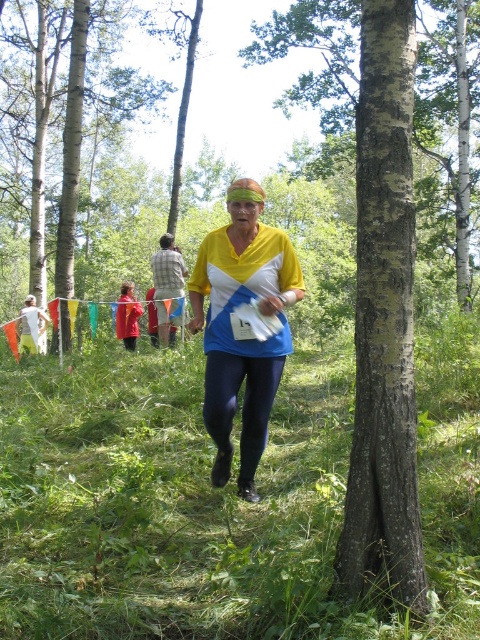
In the scene shown: Who is more distant from viewer, (251, 29) or (255, 237)?

Positioned behind is point (251, 29).

Between point (132, 241) and point (215, 289), which one is positioned in front?

Point (215, 289)

Identify the location of green bark tree at center. Image resolution: width=480 pixels, height=640 pixels. (321, 145).

Where is `green bark tree at center`? This screenshot has width=480, height=640. green bark tree at center is located at coordinates (321, 145).

What do you see at coordinates (60, 106) in the screenshot? I see `brown bark tree at upper left` at bounding box center [60, 106].

Who is positioned more to the right, brown bark tree at upper left or white paper at left?

white paper at left is more to the right.

Image resolution: width=480 pixels, height=640 pixels. Find the location of `brown bark tree at upper left`. brown bark tree at upper left is located at coordinates (60, 106).

Is white paper at left smaller than red fabric jacket at center?

No.

Is white paper at left wider than red fabric jacket at center?

Yes, white paper at left is wider than red fabric jacket at center.

Does point (40, 317) come closer to viewer compared to point (132, 300)?

Yes, it is.

The height and width of the screenshot is (640, 480). Identify the location of white paper at left. (31, 326).